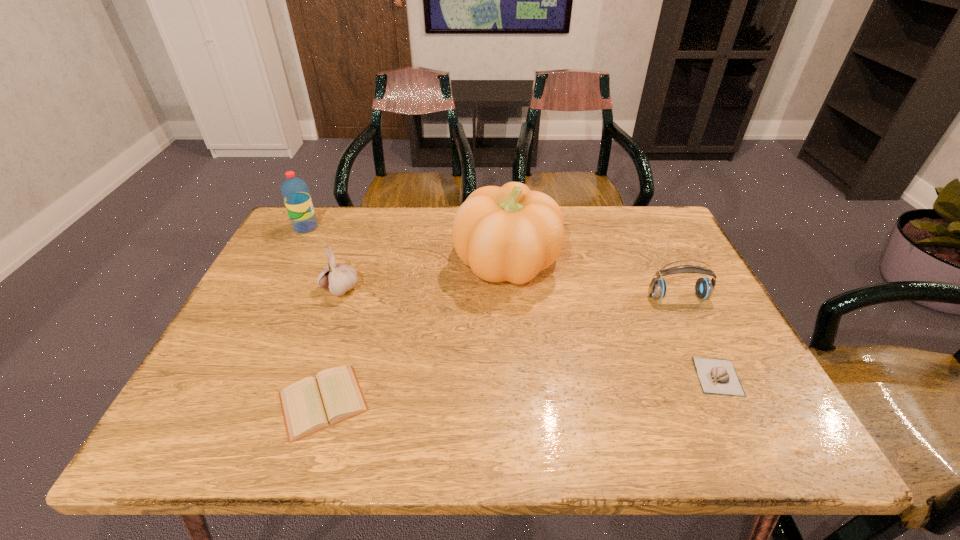
Where is `object that stands as the fifth closest to the third object from right to left`? The image size is (960, 540). object that stands as the fifth closest to the third object from right to left is located at coordinates (295, 192).

Image resolution: width=960 pixels, height=540 pixels. I want to click on object that stands as the closest to the taller garlic, so click(311, 404).

This screenshot has height=540, width=960. I want to click on vacant space that satisfies the following two spatial constraints: 1. on the ear cups of the nearer garlic; 2. on the left side of the headset, so click(x=716, y=376).

You are a GUI agent. You are given a task and a screenshot of the screen. Output one action in this format:
    pyautogui.click(x=<x>, y=<y>)
    Task: Click on the vacant space that satisfies the following two spatial constraints: 1. on the front label of the nearer garlic; 2. on the right side of the water bottle
    The image size is (960, 540).
    Given the screenshot: What is the action you would take?
    click(x=228, y=376)

What are the coordinates of `free location that satisfies the following two spatial constraints: 1. on the back side of the pumpkin; 2. on the right side of the farther garlic` in the screenshot? It's located at [350, 262].

At what (x,y) coordinates should I click in order to perform the action: click on vacant area that satisfies the following two spatial constraints: 1. on the back side of the diary; 2. on the left side of the nearer garlic. Please return your answer as a coordinate pair (x, y). The height and width of the screenshot is (540, 960). Looking at the image, I should click on (331, 376).

Identify the location of vacant region that satisfies the following two spatial constraints: 1. on the front label of the leftmost object; 2. on the left side of the pumpkin. The height and width of the screenshot is (540, 960). (288, 262).

You are a GUI agent. You are given a task and a screenshot of the screen. Output one action in this format:
    pyautogui.click(x=<x>, y=<y>)
    Task: Click on the vacant area that satisfies the following two spatial constraints: 1. on the front label of the fifth shortest object; 2. on the left side of the diary
    This screenshot has width=960, height=540.
    Given the screenshot: What is the action you would take?
    pyautogui.click(x=215, y=402)

This screenshot has height=540, width=960. What are the coordinates of `vacant area that satisfies the following two spatial constraints: 1. on the back side of the taller garlic; 2. on the front label of the fifth shortest object` in the screenshot? It's located at (363, 227).

The image size is (960, 540). What are the coordinates of `free location that satisfies the following two spatial constraints: 1. on the front label of the diary; 2. on the right side of the second tallest object` in the screenshot? It's located at (215, 402).